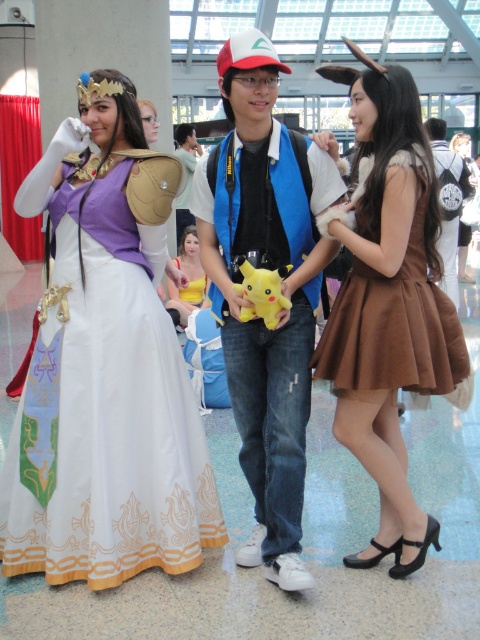
You are at the convention and want to take a photo of the brown satin dress at center. Where should you position yourself to capture it in the frame?

The brown satin dress at center is located at point (387, 301), so you should position yourself directly in front of that coordinate to capture it in the frame.

You are standing at the entrance of the convention hall and want to take a photo of the white satin dress at center. According to the coordinates provided, where should you aim your camera to capture it?

You should aim your camera at the coordinates point (113, 438) to capture the white satin dress at center.

You are a photographer at the event and want to capture the Princess Zelda costume. The point at coordinates (113, 438) is part of the costume. Which part of the costume is this point located on?

The point at coordinates (113, 438) is located on the white satin dress at center.